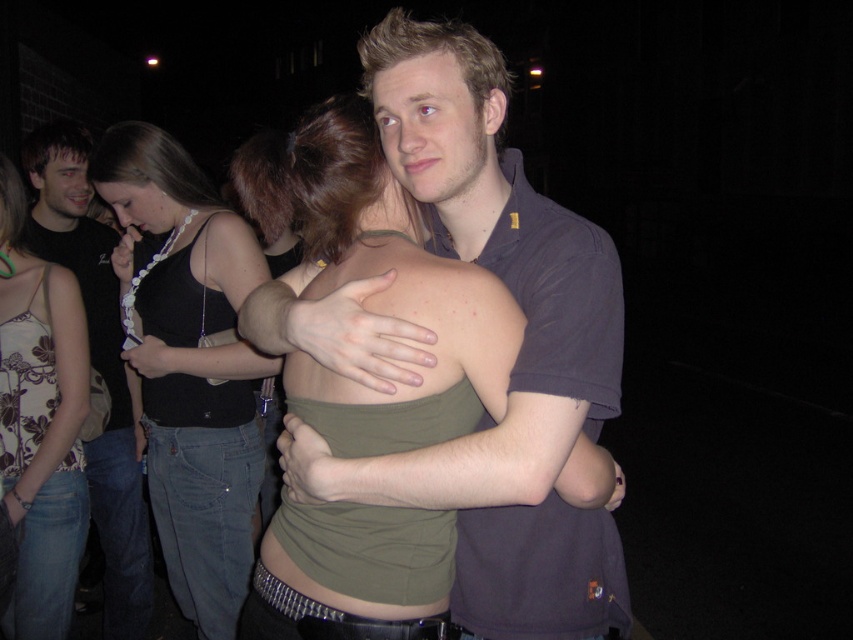
Between black fabric top at upper left and matte black tank top at left, which one has less height?

black fabric top at upper left is shorter.

This screenshot has height=640, width=853. What are the coordinates of `black fabric top at upper left` in the screenshot? It's located at pos(189,364).

The width and height of the screenshot is (853, 640). I want to click on black fabric top at upper left, so click(x=189, y=364).

Does matte olive-green tank top at center appear on the right side of black fabric top at upper left?

Yes, matte olive-green tank top at center is to the right of black fabric top at upper left.

Identify the location of matte olive-green tank top at center. The width and height of the screenshot is (853, 640). (376, 259).

What do you see at coordinates (39, 422) in the screenshot? I see `floral print tank top at left` at bounding box center [39, 422].

Is point (73, 356) positioned behind point (122, 488)?

No.

Locate an element on the screen. floral print tank top at left is located at coordinates (39, 422).